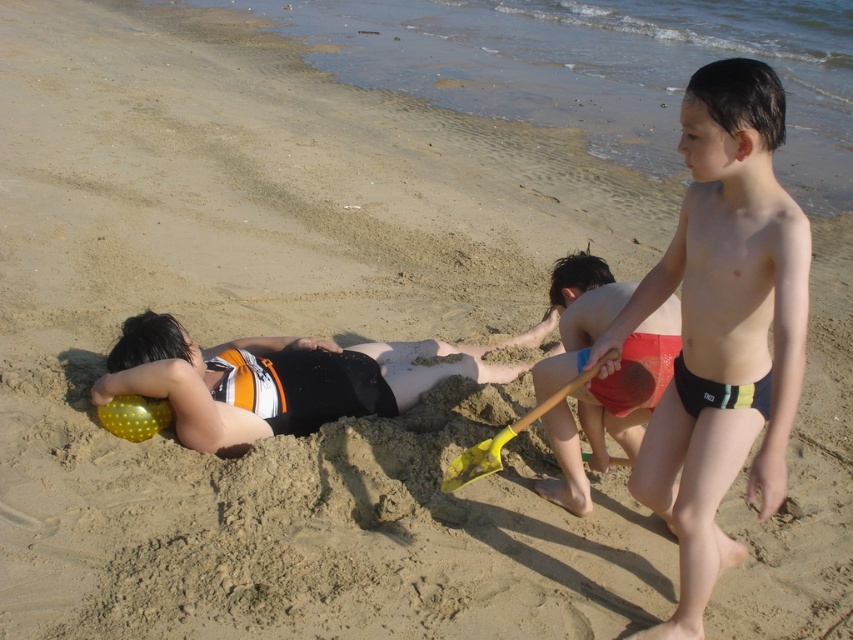
Does black swimsuit at center have a lesser height compared to yellow plastic shovel at center?

Incorrect, black swimsuit at center's height does not fall short of yellow plastic shovel at center's.

Does point (538, 328) come behind point (457, 486)?

That is True.

Where is `black swimsuit at center`? Image resolution: width=853 pixels, height=640 pixels. black swimsuit at center is located at coordinates (281, 378).

Locate an element on the screen. black swimsuit at center is located at coordinates (281, 378).

Which is in front, point (735, 349) or point (201, 384)?

Positioned in front is point (735, 349).

Identify the location of multicolored swim trunks at center. This screenshot has width=853, height=640. (723, 326).

Is point (635, 637) behind point (376, 388)?

No, (635, 637) is closer to viewer.

Locate an element on the screen. The image size is (853, 640). multicolored swim trunks at center is located at coordinates (723, 326).

Can you confirm if red fabric shorts at center is positioned below yellow plastic shovel at center?

Actually, red fabric shorts at center is above yellow plastic shovel at center.

I want to click on red fabric shorts at center, so click(630, 385).

Who is more forward, (560,433) or (543,408)?

Point (543,408) is more forward.

Where is `red fabric shorts at center`? This screenshot has height=640, width=853. red fabric shorts at center is located at coordinates (630, 385).